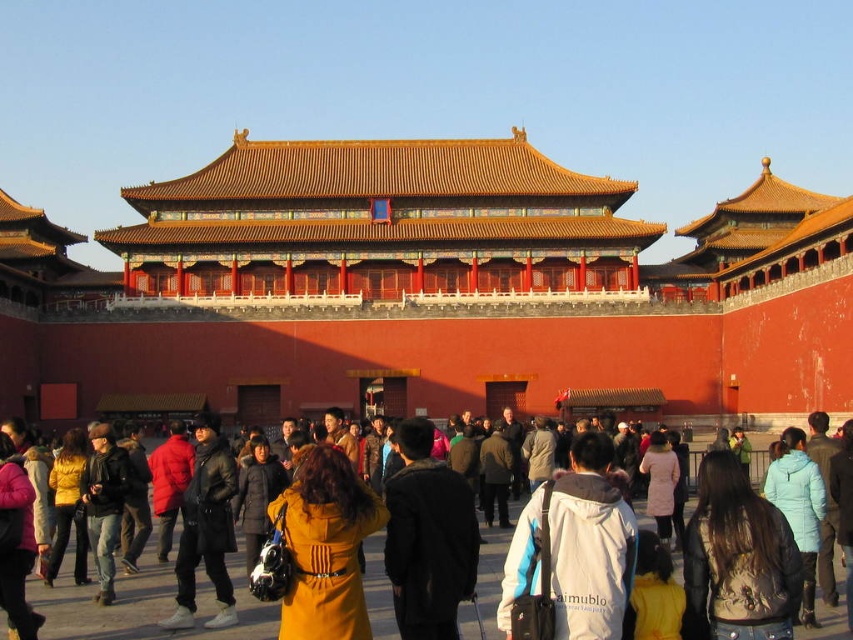
Can you confirm if red painted wood palace at center is wider than brown leather jacket at lower right?

Yes, red painted wood palace at center is wider than brown leather jacket at lower right.

Who is lower down, red painted wood palace at center or brown leather jacket at lower right?

brown leather jacket at lower right is below.

Locate an element on the screen. red painted wood palace at center is located at coordinates (438, 292).

Is dark brown leather jacket at center shorter than brown leather jacket at lower right?

Indeed, dark brown leather jacket at center has a lesser height compared to brown leather jacket at lower right.

Who is positioned more to the left, dark brown leather jacket at center or brown leather jacket at lower right?

dark brown leather jacket at center

Between point (61, 602) and point (738, 598), which one is positioned in front?

Point (738, 598) is more forward.

In order to click on dark brown leather jacket at center in this screenshot , I will do `click(144, 605)`.

Is point (630, 250) more distant than point (305, 580)?

That is True.

Describe the element at coordinates (438, 292) in the screenshot. I see `red painted wood palace at center` at that location.

Between point (326, 300) and point (297, 609), which one is positioned behind?

The point (326, 300) is more distant.

This screenshot has height=640, width=853. Find the location of `red painted wood palace at center`. red painted wood palace at center is located at coordinates (438, 292).